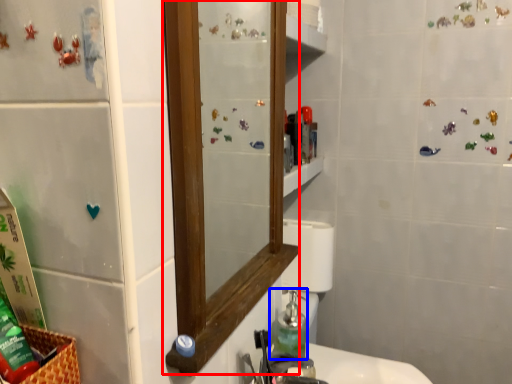
Question: Among these objects, which one is farthest to the camera, mirror (highlighted by a red box) or soap dispenser (highlighted by a blue box)?

Choices:
 (A) mirror
 (B) soap dispenser

Answer: (B)